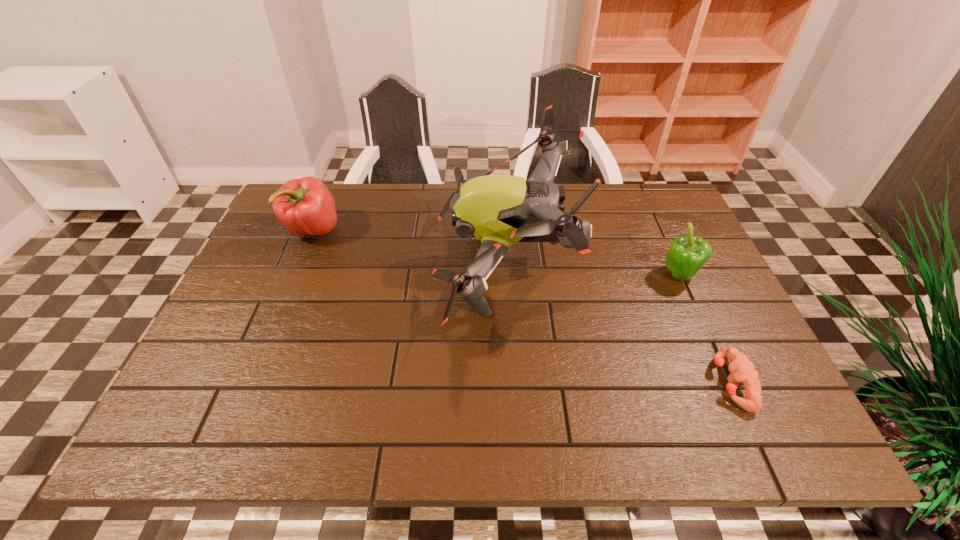
What are the coordinates of `free location located 0.050m on the back of the right bell pepper` in the screenshot? It's located at (668, 252).

You are a GUI agent. You are given a task and a screenshot of the screen. Output one action in this format:
    pyautogui.click(x=<x>, y=<y>)
    Task: Click on the vacant area situated 0.290m with the gloves of the puncher facing forward
    The width and height of the screenshot is (960, 540).
    Given the screenshot: What is the action you would take?
    pyautogui.click(x=573, y=383)

You are a GUI agent. You are given a task and a screenshot of the screen. Output one action in this format:
    pyautogui.click(x=<x>, y=<y>)
    Task: Click on the vacant space situated 0.310m with the gloves of the puncher facing forward
    The width and height of the screenshot is (960, 540).
    Given the screenshot: What is the action you would take?
    pyautogui.click(x=564, y=383)

In order to click on free space located with the gloves of the puncher facing forward in this screenshot , I will do `click(690, 383)`.

Find the location of a particular element. The image size is (960, 540). drone at the far edge is located at coordinates (498, 211).

In order to click on bell pepper at the far edge in this screenshot , I will do `click(305, 207)`.

Identify the location of object that is at the near edge. (742, 371).

Where is `object present at the left edge`? The image size is (960, 540). object present at the left edge is located at coordinates (305, 207).

At what (x,y) coordinates should I click in order to perform the action: click on bell pepper that is positioned at the right edge. Please return your answer as a coordinate pair (x, y). Looking at the image, I should click on (687, 254).

Where is `puncher that is at the right edge`? The image size is (960, 540). puncher that is at the right edge is located at coordinates (742, 371).